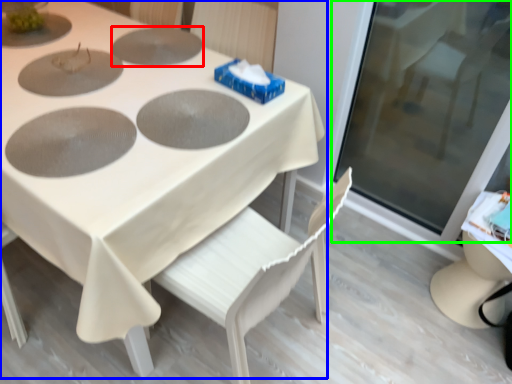
Question: Estimate the real-world distances between objects in this image. Which object is farther from pizza pan (highlighted by a red box), table (highlighted by a blue box) or glass door (highlighted by a green box)?

Choices:
 (A) table
 (B) glass door

Answer: (B)